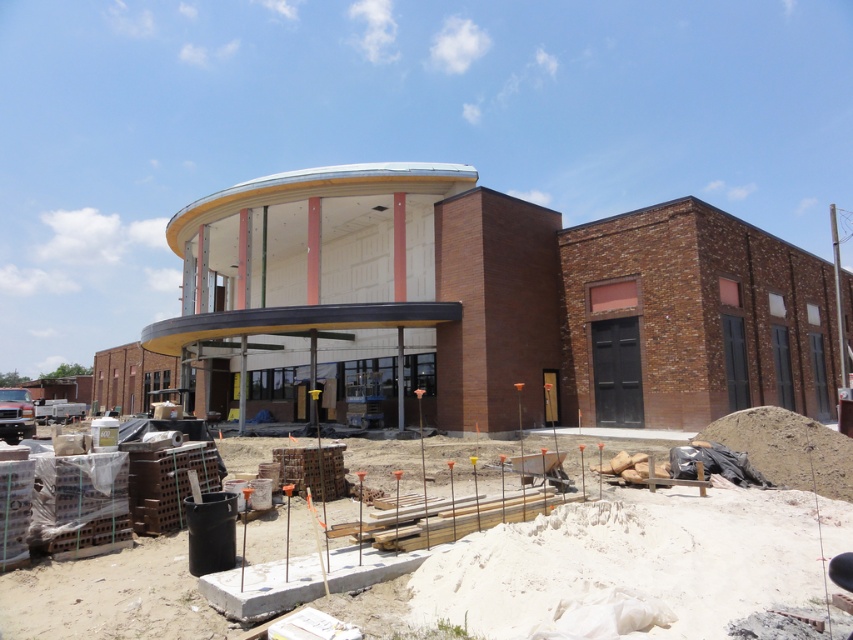
Is the position of white smooth building at center more distant than that of concrete blocks at lower left?

Yes.

Does white smooth building at center appear under concrete blocks at lower left?

No, white smooth building at center is not below concrete blocks at lower left.

What do you see at coordinates (494, 305) in the screenshot? I see `white smooth building at center` at bounding box center [494, 305].

Identify the location of white smooth building at center. (494, 305).